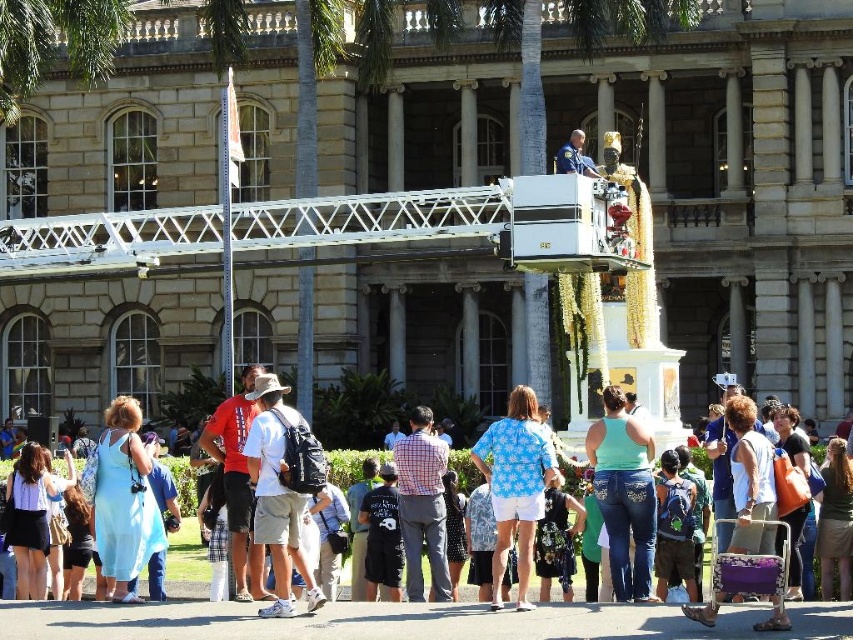
Question: Which of these objects is positioned farthest from the light blue fabric dress at lower left?

Choices:
 (A) gray stone building at center
 (B) denim jeans at center
 (C) light blue denim skirt at lower left
 (D) brown fabric skirt at lower right

Answer: (A)

Question: Does white cotton shirt at center appear under light blue fabric dress at lower left?

Choices:
 (A) yes
 (B) no

Answer: (B)

Question: Can you confirm if gray stone building at center is positioned above black printed dress at center?

Choices:
 (A) no
 (B) yes

Answer: (B)

Question: Estimate the real-world distances between objects in this image. Which object is closer to the gray stone building at center?

Choices:
 (A) denim jeans at lower right
 (B) denim jeans at center

Answer: (B)

Question: Based on their relative distances, which object is farther from the gray stone building at center?

Choices:
 (A) black printed dress at center
 (B) blue printed shirt at center
 (C) denim jeans at lower right

Answer: (B)

Question: Is blue printed shirt at center bigger than black printed dress at center?

Choices:
 (A) yes
 (B) no

Answer: (A)